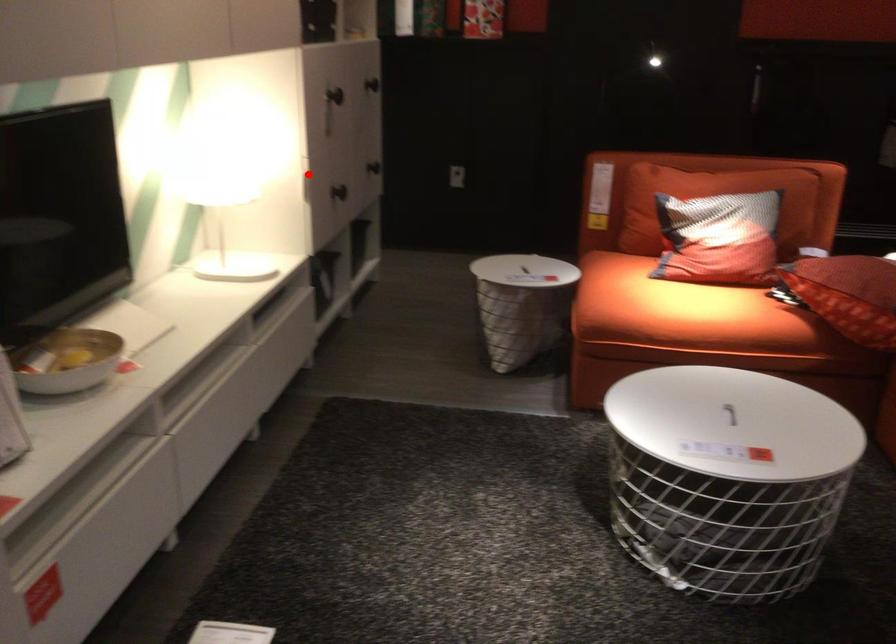
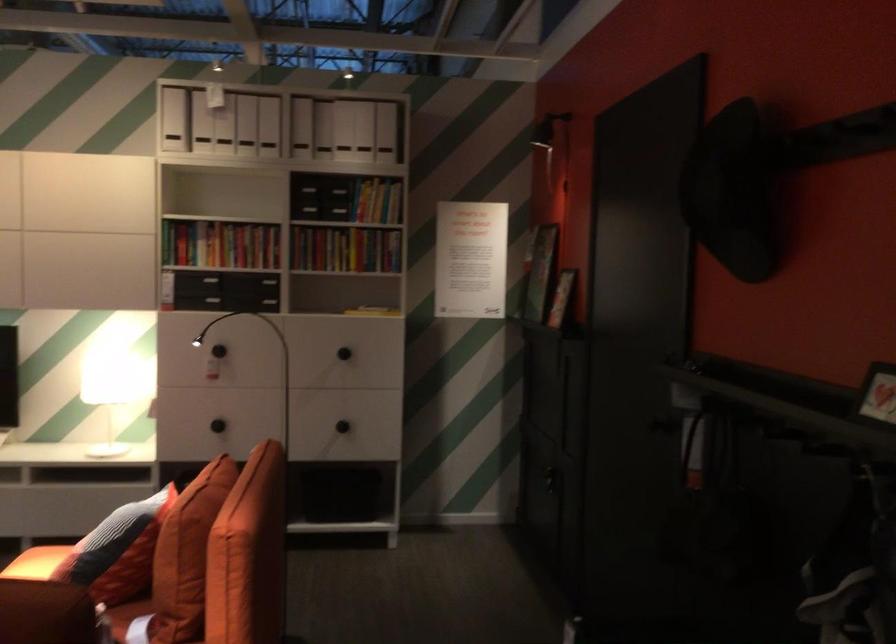
In the second image, find the point that corresponds to the highlighted location in the first image.

(108, 391)